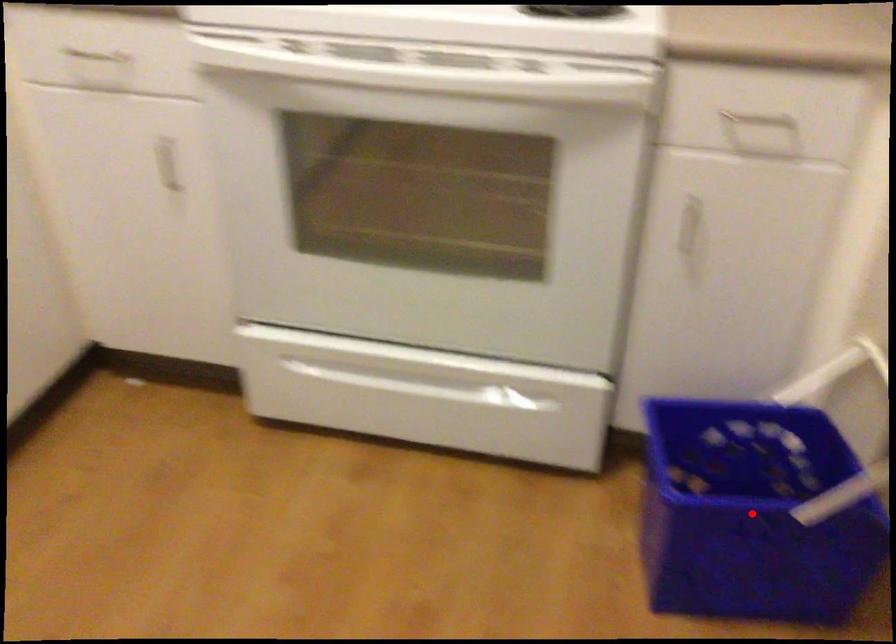
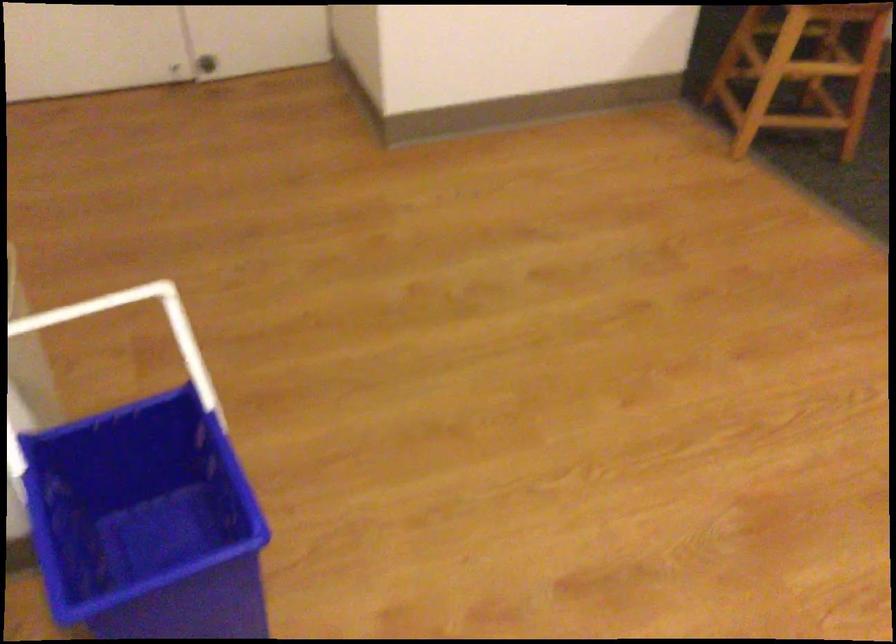
Question: I am providing you with two images of the same scene from different viewpoints. A red point is marked on the first image. Can you still see the location of the red point in image 2?

Choices:
 (A) Yes
 (B) No

Answer: (B)